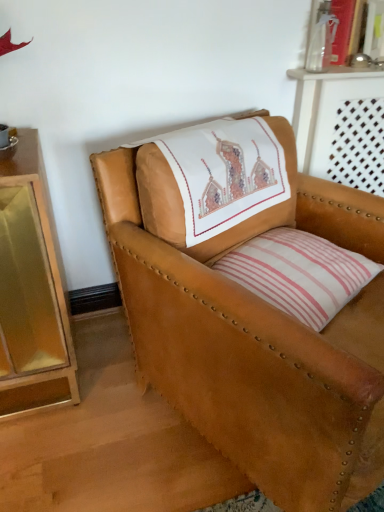
Question: Considering the positions of tan leather chair at center and white striped pillow at center in the image, is tan leather chair at center taller or shorter than white striped pillow at center?

Choices:
 (A) tall
 (B) short

Answer: (A)

Question: Is tan leather chair at center situated inside white striped pillow at center or outside?

Choices:
 (A) inside
 (B) outside

Answer: (B)

Question: Considering the positions of point (279, 474) and point (281, 245), is point (279, 474) closer or farther from the camera than point (281, 245)?

Choices:
 (A) closer
 (B) farther

Answer: (A)

Question: Is white striped pillow at center taller or shorter than tan leather chair at center?

Choices:
 (A) tall
 (B) short

Answer: (B)

Question: In terms of width, does white striped pillow at center look wider or thinner when compared to tan leather chair at center?

Choices:
 (A) thin
 (B) wide

Answer: (A)

Question: Is point click(x=276, y=257) positioned closer to the camera than point click(x=264, y=398)?

Choices:
 (A) closer
 (B) farther

Answer: (B)

Question: Looking at the image, does white striped pillow at center seem bigger or smaller compared to tan leather chair at center?

Choices:
 (A) small
 (B) big

Answer: (A)